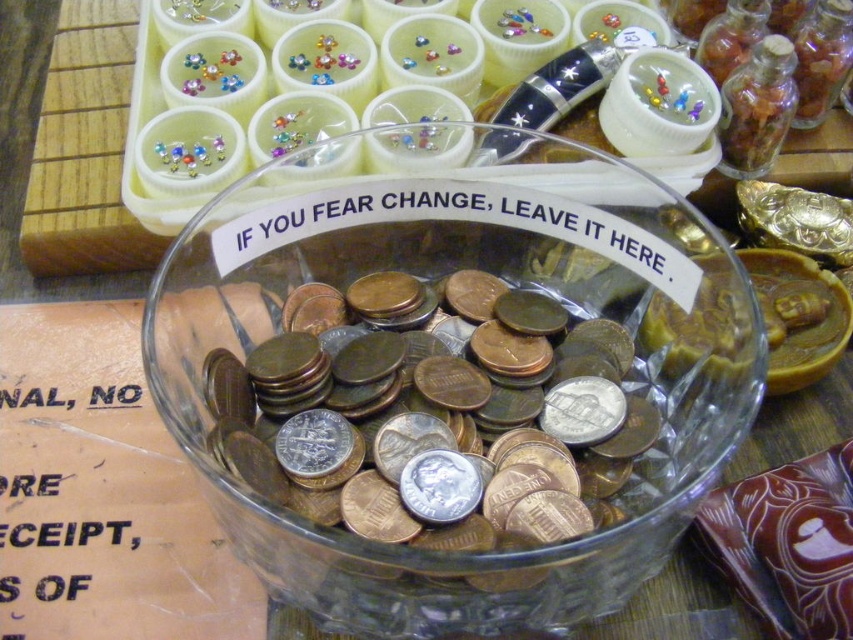
Question: Does clear glass bowl at center appear under silver metallic coins at center?

Choices:
 (A) no
 (B) yes

Answer: (A)

Question: Is clear glass bowl at center smaller than silver metallic coins at center?

Choices:
 (A) no
 (B) yes

Answer: (A)

Question: Which point appears farthest from the camera in this image?

Choices:
 (A) tap(392, 467)
 (B) tap(253, 410)

Answer: (B)

Question: Can you confirm if clear glass bowl at center is positioned to the right of silver metallic coins at center?

Choices:
 (A) yes
 (B) no

Answer: (B)